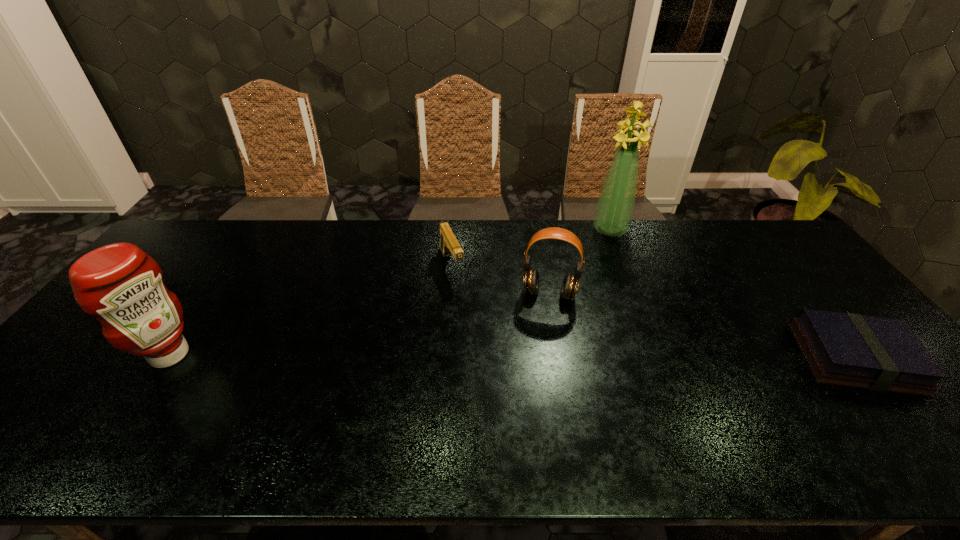
Where is `condiment`? This screenshot has width=960, height=540. condiment is located at coordinates (119, 284).

I want to click on the fourth shortest object, so click(119, 284).

Find the location of a particular element. The image size is (960, 540). book is located at coordinates (882, 354).

What are the coordinates of `the rightmost object` in the screenshot? It's located at (882, 354).

The image size is (960, 540). I want to click on the tallest object, so click(615, 207).

The image size is (960, 540). In order to click on bouquet in this screenshot , I will do `click(615, 207)`.

Find the location of a particular element. The width and height of the screenshot is (960, 540). the second shortest object is located at coordinates (449, 245).

Image resolution: width=960 pixels, height=540 pixels. Identify the location of the second object from left to right. (449, 245).

The image size is (960, 540). In order to click on the third object from right to left in this screenshot , I will do `click(570, 284)`.

What are the coordinates of `headset` in the screenshot? It's located at (570, 284).